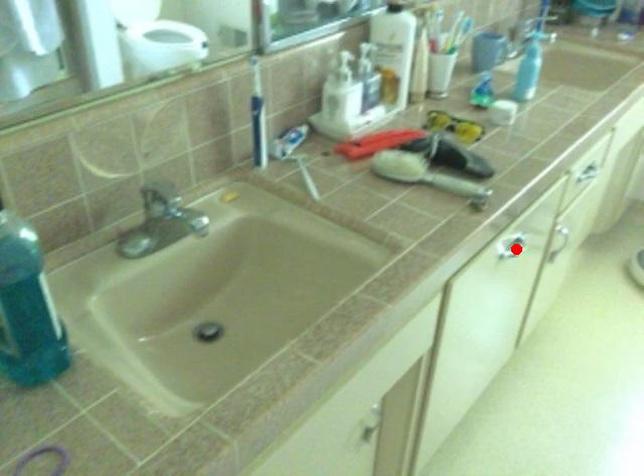
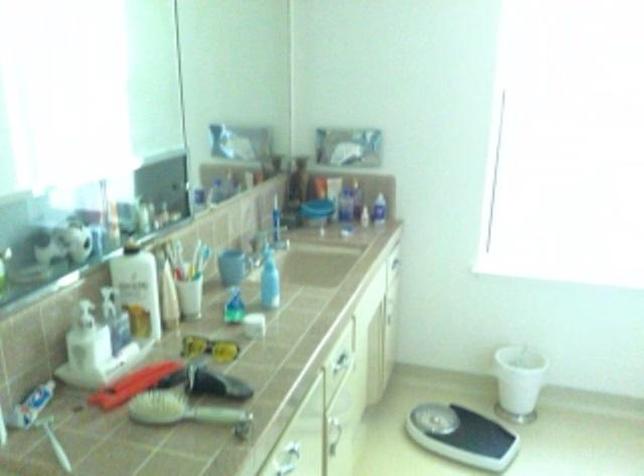
Question: I am providing you with two images of the same scene from different viewpoints. A red point is marked on the first image. Can you still see the location of the red point in image 2?

Choices:
 (A) Yes
 (B) No

Answer: (A)